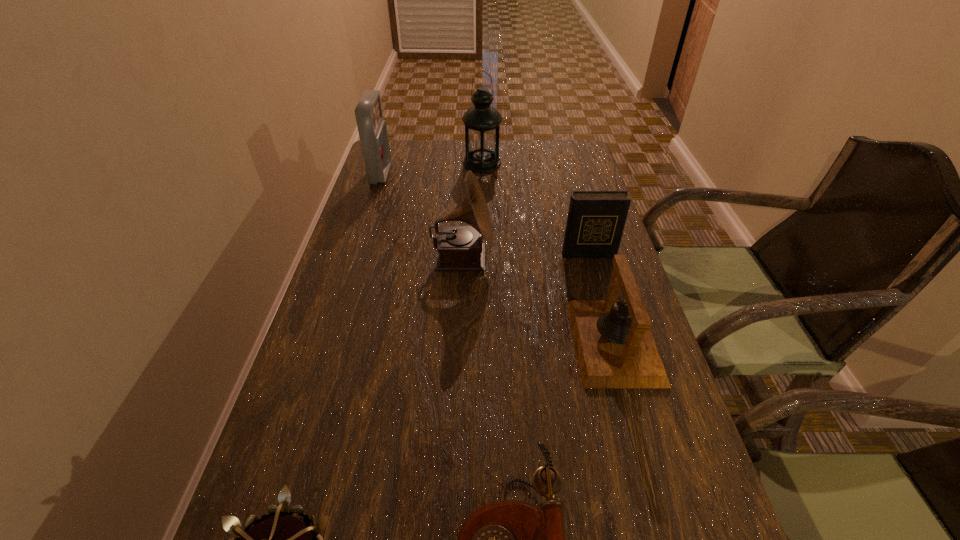
Locate an element on the screen. The width and height of the screenshot is (960, 540). oil lamp located in the far edge section of the desktop is located at coordinates (481, 121).

The image size is (960, 540). I want to click on the first-aid kit at the far edge, so click(372, 129).

Locate an element on the screen. The width and height of the screenshot is (960, 540). object at the left edge is located at coordinates click(x=372, y=129).

At what (x,y) coordinates should I click in order to perform the action: click on diary that is at the right edge. Please return your answer as a coordinate pair (x, y). The height and width of the screenshot is (540, 960). Looking at the image, I should click on (596, 219).

Image resolution: width=960 pixels, height=540 pixels. Find the location of `bell present at the right edge`. bell present at the right edge is located at coordinates 615,348.

The height and width of the screenshot is (540, 960). What are the coordinates of `object that is at the far left corner` in the screenshot? It's located at (372, 129).

In the image, there is a desktop. Where is `free region at the far edge`? This screenshot has width=960, height=540. free region at the far edge is located at coordinates point(462,146).

You are a GUI agent. You are given a task and a screenshot of the screen. Output one action in this format:
    pyautogui.click(x=<x>, y=<y>)
    Task: Click on the free region at the left edge of the desktop
    This screenshot has width=960, height=540.
    Given the screenshot: What is the action you would take?
    pyautogui.click(x=391, y=178)

I want to click on vacant space at the right edge of the desktop, so click(563, 180).

You are a GUI agent. You are given a task and a screenshot of the screen. Output one action in this format:
    pyautogui.click(x=<x>, y=<y>)
    Task: Click on the free space between the first-aid kit and the phonograph record
    This screenshot has height=540, width=960.
    Given the screenshot: What is the action you would take?
    pyautogui.click(x=421, y=217)